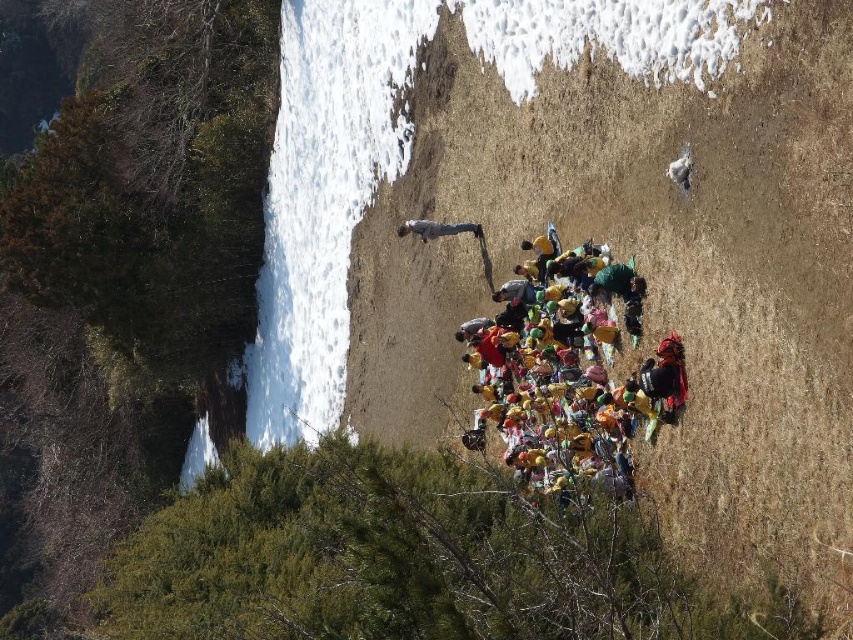
Based on the photo, you are planning to set up a picnic blanket for a group of people. You have a multicolored fabric at center and light gray jeans at upper center available. Which item is larger and more suitable for covering a larger area?

The multicolored fabric at center is bigger than the light gray jeans at upper center, making it more suitable for covering a larger area.

You are part of a group planning to set up a picnic area in the mountainous area shown. You have a picnic blanket that needs to be placed exactly at point 0.591, 0.672. Is the multicolored fabric at center already occupying that location?

Yes, the multicolored fabric at center is located at point (572, 378), so it is already occupying that location.